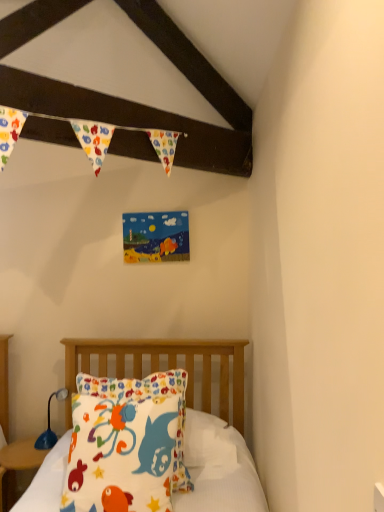
Question: Considering the positions of fluffy cotton pillow at lower left and white cotton pillow at center in the image, is fluffy cotton pillow at lower left wider or thinner than white cotton pillow at center?

Choices:
 (A) wide
 (B) thin

Answer: (B)

Question: Considering their positions, is fluffy cotton pillow at lower left located in front of or behind white cotton pillow at center?

Choices:
 (A) front
 (B) behind

Answer: (A)

Question: Which object is positioned farthest from the matte wood nightstand at lower left?

Choices:
 (A) blue plastic lamp at lower left
 (B) fluffy cotton pillow at lower left
 (C) white cotton pillow at center

Answer: (B)

Question: Which object is the closest to the white cotton pillow at center?

Choices:
 (A) blue plastic lamp at lower left
 (B) matte wood nightstand at lower left
 (C) fluffy cotton pillow at lower left

Answer: (A)